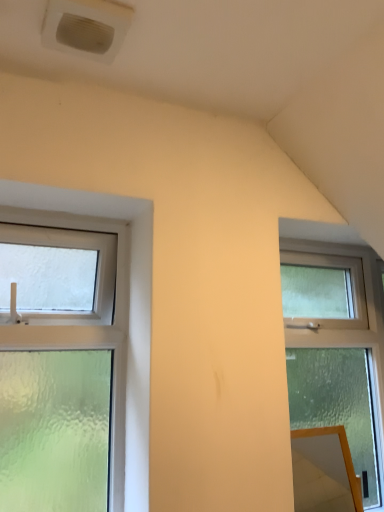
Question: Is white plastic air conditioning unit at upper left wider than orange glossy mirror at lower right?

Choices:
 (A) yes
 (B) no

Answer: (A)

Question: From a real-world perspective, is white plastic air conditioning unit at upper left over orange glossy mirror at lower right?

Choices:
 (A) yes
 (B) no

Answer: (A)

Question: Does white plastic air conditioning unit at upper left have a smaller size compared to orange glossy mirror at lower right?

Choices:
 (A) no
 (B) yes

Answer: (B)

Question: From a real-world perspective, is white plastic air conditioning unit at upper left below orange glossy mirror at lower right?

Choices:
 (A) yes
 (B) no

Answer: (B)

Question: Is white plastic air conditioning unit at upper left facing away from orange glossy mirror at lower right?

Choices:
 (A) yes
 (B) no

Answer: (B)

Question: Would you consider white plastic air conditioning unit at upper left to be distant from orange glossy mirror at lower right?

Choices:
 (A) yes
 (B) no

Answer: (A)

Question: Considering the relative positions of white plastic air conditioning unit at upper left and clear frosted glass window at right, the 2th window from the left, in the image provided, is white plastic air conditioning unit at upper left behind clear frosted glass window at right, the 2th window from the left,?

Choices:
 (A) no
 (B) yes

Answer: (A)

Question: Is white plastic air conditioning unit at upper left not within clear frosted glass window at right, the 2th window from the left?

Choices:
 (A) no
 (B) yes

Answer: (B)

Question: Is white plastic air conditioning unit at upper left next to clear frosted glass window at right, the 2th window from the left?

Choices:
 (A) no
 (B) yes

Answer: (A)

Question: Is white plastic air conditioning unit at upper left positioned before clear frosted glass window at right, the 2th window from the left?

Choices:
 (A) yes
 (B) no

Answer: (A)

Question: Considering the relative sizes of white plastic air conditioning unit at upper left and clear frosted glass window at right, the first window viewed from the right, in the image provided, is white plastic air conditioning unit at upper left taller than clear frosted glass window at right, the first window viewed from the right,?

Choices:
 (A) no
 (B) yes

Answer: (A)

Question: Could you tell me if white plastic air conditioning unit at upper left is facing clear frosted glass window at right, the first window viewed from the right?

Choices:
 (A) yes
 (B) no

Answer: (B)

Question: Is clear frosted glass window at right, the 2th window from the left, positioned far away from orange glossy mirror at lower right?

Choices:
 (A) yes
 (B) no

Answer: (B)